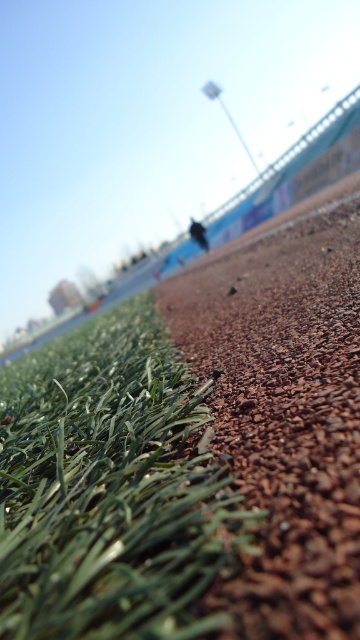
You are a gardener who needs to plant a new flower bed. You have two options for the soil base. The first option is to use the green artificial turf at lower left, and the second is to use the brown gravel at center. Considering their heights, which material would allow the flowers to have more space to grow upwards?

The brown gravel at center is taller than the green artificial turf at lower left, so planting flowers in the brown gravel at center would provide more vertical space for growth.

Looking at this image, you are a landscape architect designing a new sports field. You need to ensure that the green artificial turf at lower left and the brown gravel at center meet specific width requirements. According to the image, which area is narrower?

The green artificial turf at lower left has a lesser width compared to the brown gravel at center, so the green artificial turf at lower left is narrower.

You are standing at the center of the sports field and want to place a small marker exactly at the position of the green artificial turf at lower left. According to the coordinates provided, where should you place the marker?

The green artificial turf at lower left is located at point (x=110, y=486), so you should place the marker at those coordinates.